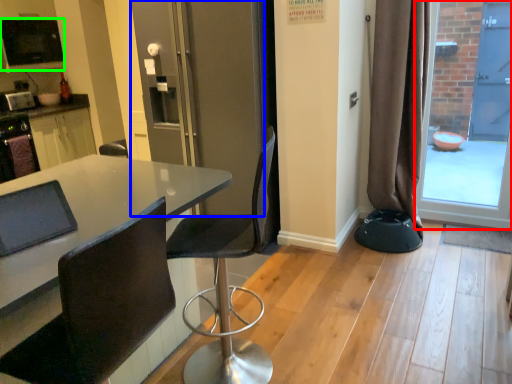
Question: Considering the real-world distances, which object is closest to glass door (highlighted by a red box)? screen door (highlighted by a blue box) or appliance (highlighted by a green box).

Choices:
 (A) screen door
 (B) appliance

Answer: (A)